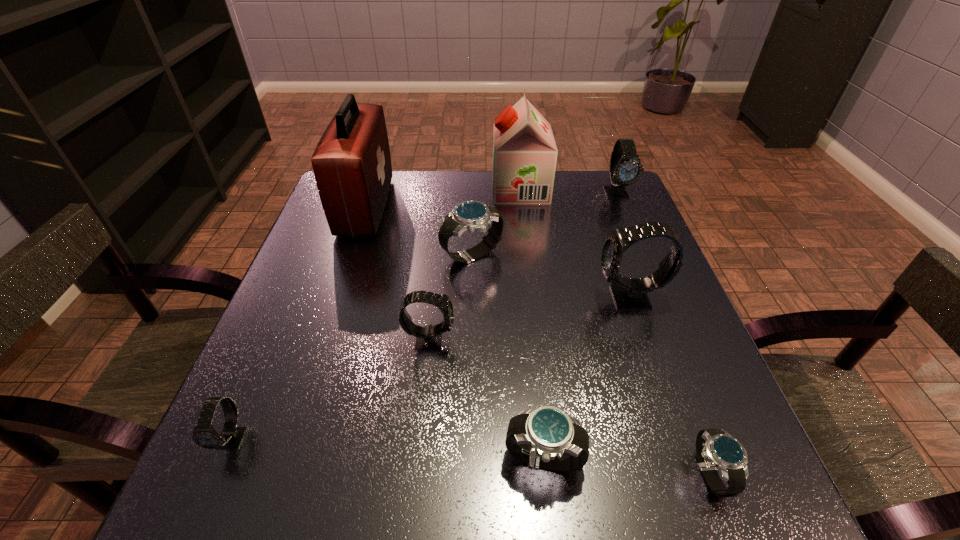
Find the location of a particular element. The image size is (960, 540). blank space located 0.190m on the face of the third tallest object is located at coordinates (504, 298).

Where is `vacant point located 0.240m on the face of the third tallest object`? This screenshot has height=540, width=960. vacant point located 0.240m on the face of the third tallest object is located at coordinates (480, 298).

The height and width of the screenshot is (540, 960). In order to click on free space located on the face of the third tallest object in this screenshot , I will do `click(533, 298)`.

At what (x,y) coordinates should I click in order to perform the action: click on vacant space situated on the face of the sixth shortest watch. Please return your answer as a coordinate pair (x, y). This screenshot has height=540, width=960. Looking at the image, I should click on (647, 265).

Where is `free spot located 0.310m on the left of the farthest silver watch`? free spot located 0.310m on the left of the farthest silver watch is located at coordinates (307, 255).

Identify the location of free space located on the face of the third gray watch from right to left. The height and width of the screenshot is (540, 960). (586, 339).

Locate an element on the screen. This screenshot has width=960, height=540. free space located 0.290m on the back of the second smallest silver watch is located at coordinates (527, 304).

Locate an element on the screen. This screenshot has width=960, height=540. free space located on the face of the nearest gray watch is located at coordinates (207, 496).

Locate an element on the screen. vacant space located 0.280m on the back of the smallest silver watch is located at coordinates (647, 312).

The height and width of the screenshot is (540, 960). I want to click on the first aid kit positioned at the far edge, so (x=352, y=166).